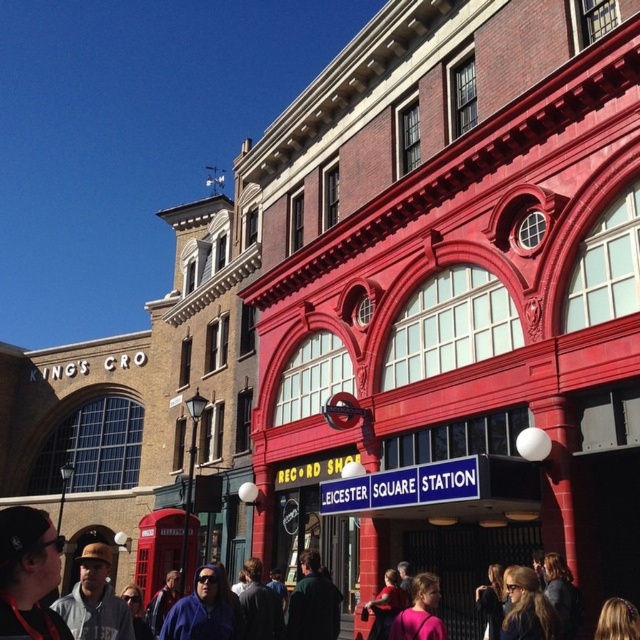
Does point (3, 525) lie behind point (35, 518)?

That is False.

This screenshot has width=640, height=640. I want to click on dark clothing crowd at lower center, so click(x=26, y=566).

Between dark clothing crowd at lower center and gray hoodie at lower left, which one appears on the right side from the viewer's perspective?

Positioned to the right is gray hoodie at lower left.

Which is behind, point (54, 573) or point (129, 627)?

Point (129, 627)

Where is `dark clothing crowd at lower center`? This screenshot has width=640, height=640. dark clothing crowd at lower center is located at coordinates (26, 566).

Does matte black cap at lower left lie behind gray hoodie at lower left?

That is False.

In the scene shown: Does matte black cap at lower left have a larger size compared to gray hoodie at lower left?

Incorrect, matte black cap at lower left is not larger than gray hoodie at lower left.

Is point (1, 547) farther from camera compared to point (120, 616)?

No, it is not.

Find the location of `matte black cap at lower left`. matte black cap at lower left is located at coordinates (28, 573).